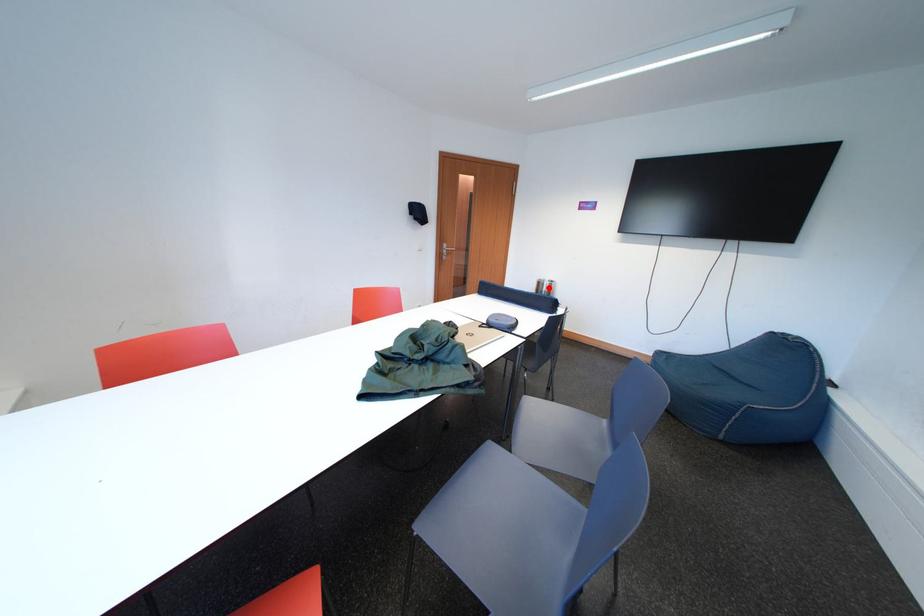
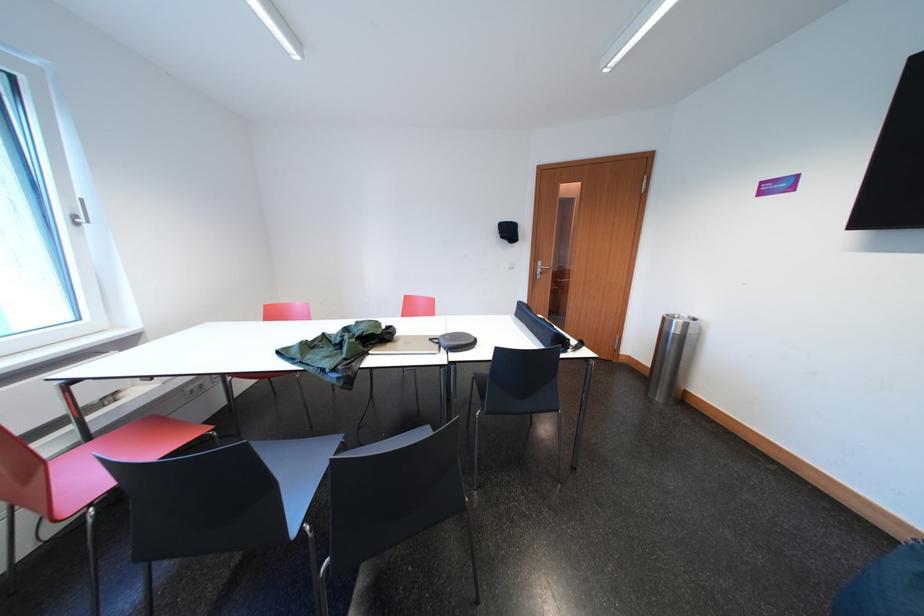
Question: I am providing you with two images of the same scene from different viewpoints. Given a red point in image1, look at the same physical point in image2. Is it:

Choices:
 (A) Closer to the viewpoint
 (B) Farther from the viewpoint

Answer: (B)